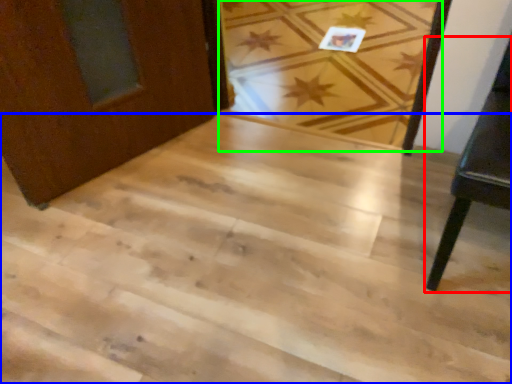
Question: Estimate the real-world distances between objects in this image. Which object is closer to furniture (highlighted by a red box), stairwell (highlighted by a blue box) or plank (highlighted by a green box)?

Choices:
 (A) stairwell
 (B) plank

Answer: (A)